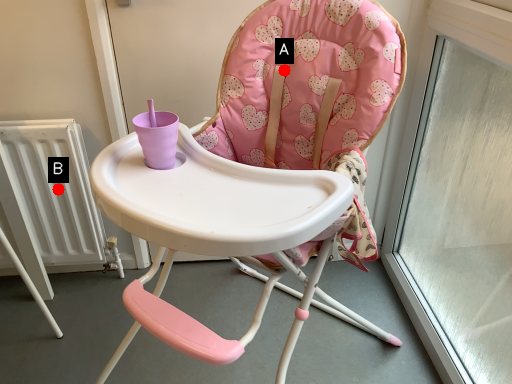
Question: Two points are circled on the image, labeled by A and B beside each circle. Which point is closer to the camera taking this photo?

Choices:
 (A) A is closer
 (B) B is closer

Answer: (A)